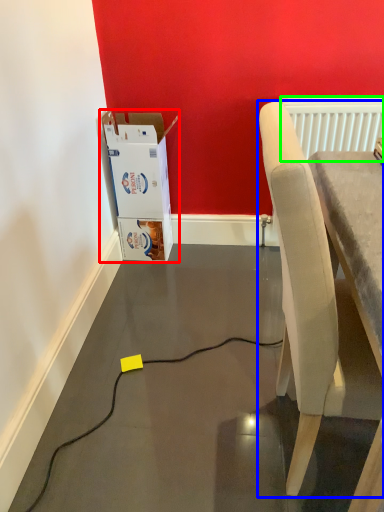
Question: Which is farther away from cardboard box (highlighted by a red box)? chair (highlighted by a blue box) or radiator (highlighted by a green box)?

Choices:
 (A) chair
 (B) radiator

Answer: (A)